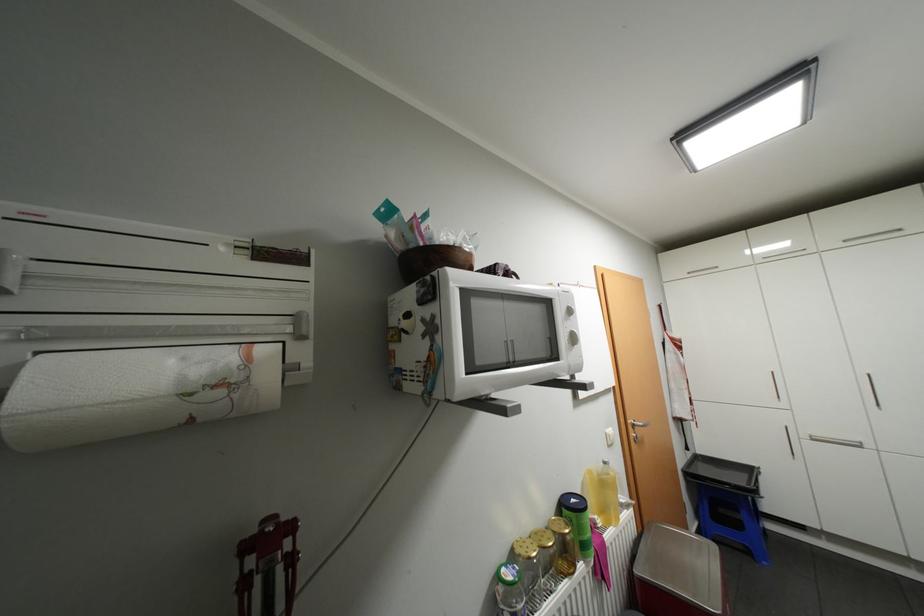
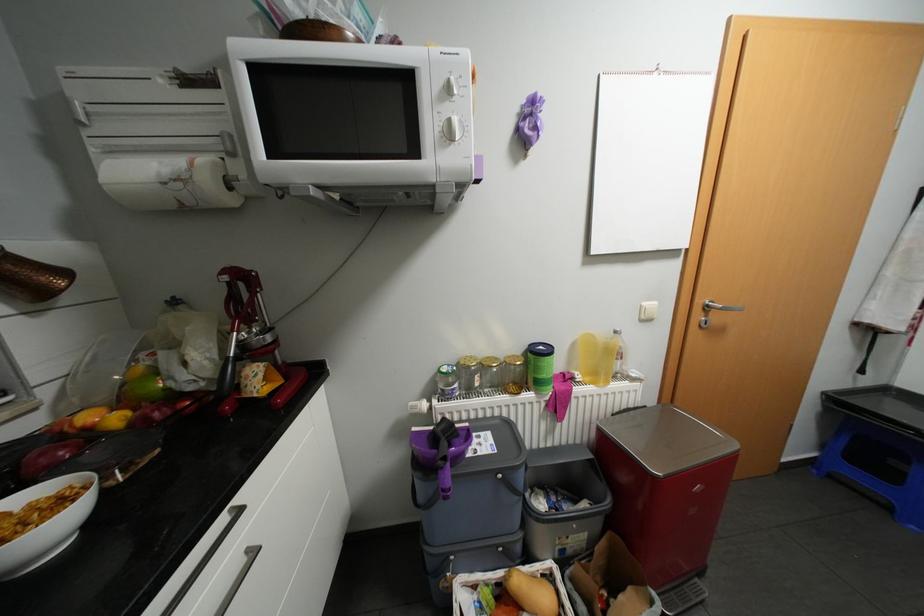
Find the pixel in the second image that matches point 518,576 in the first image.

(452, 369)